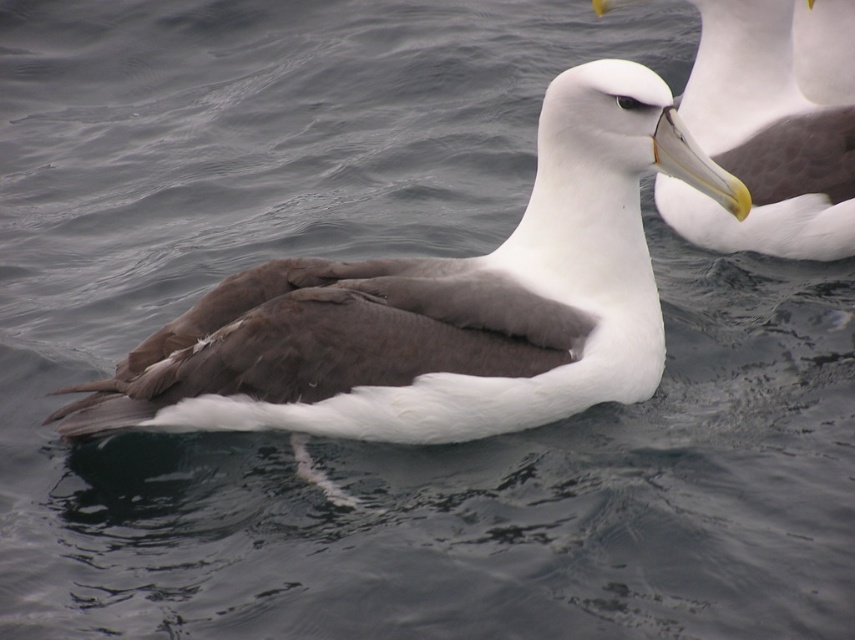
Question: Does white matte bird at center have a larger size compared to white glossy beak at upper center?

Choices:
 (A) no
 (B) yes

Answer: (B)

Question: Which point is closer to the camera taking this photo?

Choices:
 (A) (755, 42)
 (B) (618, 60)

Answer: (B)

Question: Which point is farther to the camera?

Choices:
 (A) (493, 364)
 (B) (752, 180)

Answer: (B)

Question: Can you confirm if white matte bird at center is positioned to the left of white glossy beak at upper center?

Choices:
 (A) no
 (B) yes

Answer: (B)

Question: Does white matte bird at center have a greater width compared to white glossy beak at upper center?

Choices:
 (A) no
 (B) yes

Answer: (B)